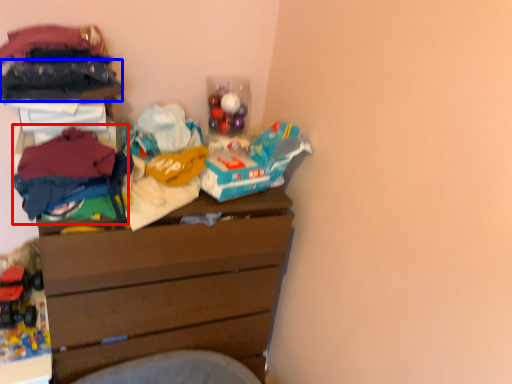
Question: Which of the following is the farthest to the observer, clothing (highlighted by a red box) or clothing (highlighted by a blue box)?

Choices:
 (A) clothing
 (B) clothing

Answer: (B)